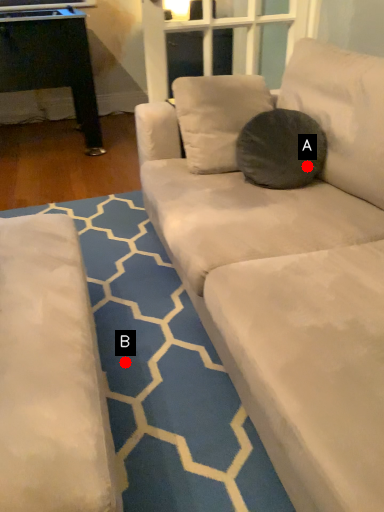
Question: Two points are circled on the image, labeled by A and B beside each circle. Among these points, which one is nearest to the camera?

Choices:
 (A) A is closer
 (B) B is closer

Answer: (B)